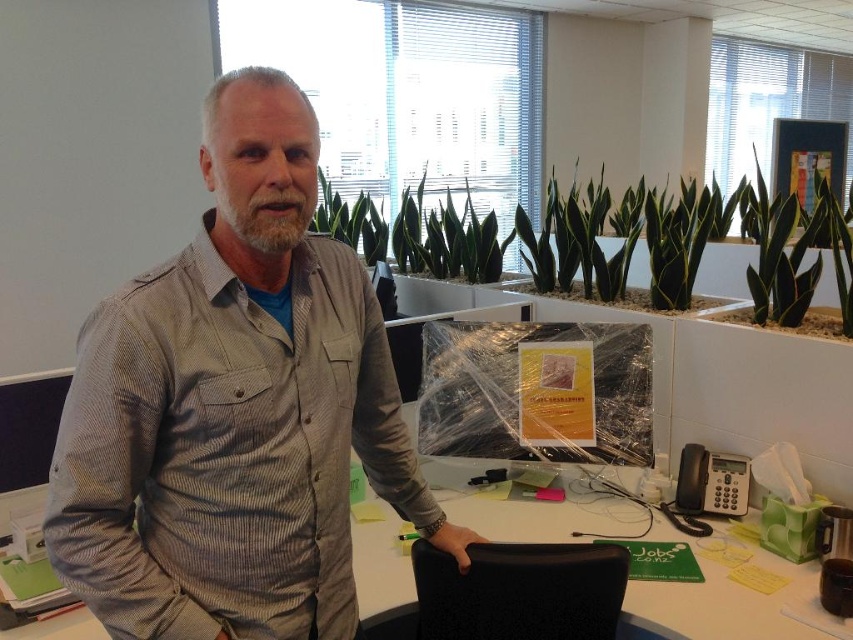
Question: Which point appears closest to the camera in this image?

Choices:
 (A) (842, 259)
 (B) (671, 529)
 (C) (447, 596)

Answer: (C)

Question: Which of these objects is positioned farthest from the black textured swivel chair at center?

Choices:
 (A) green leafy plant at center
 (B) white plastic table at center
 (C) gray striped shirt at center

Answer: (A)

Question: Does green leafy plant at center have a lesser width compared to black textured swivel chair at center?

Choices:
 (A) no
 (B) yes

Answer: (A)

Question: Which of the following is the farthest from the observer?

Choices:
 (A) gray striped shirt at center
 (B) black textured swivel chair at center

Answer: (B)

Question: Can you confirm if gray striped shirt at center is wider than black textured swivel chair at center?

Choices:
 (A) no
 (B) yes

Answer: (B)

Question: Does gray striped shirt at center have a lesser width compared to black textured swivel chair at center?

Choices:
 (A) no
 (B) yes

Answer: (A)